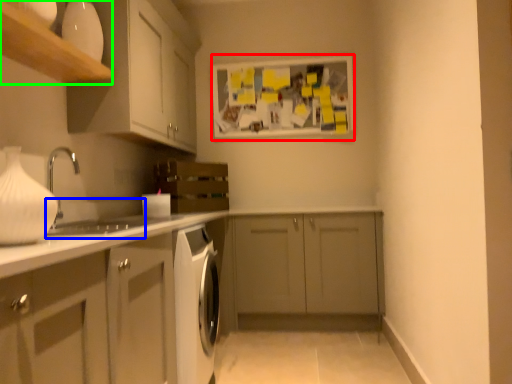
Question: Considering the real-world distances, which object is farthest from bulletin board (highlighted by a red box)? sink (highlighted by a blue box) or shelf (highlighted by a green box)?

Choices:
 (A) sink
 (B) shelf

Answer: (B)